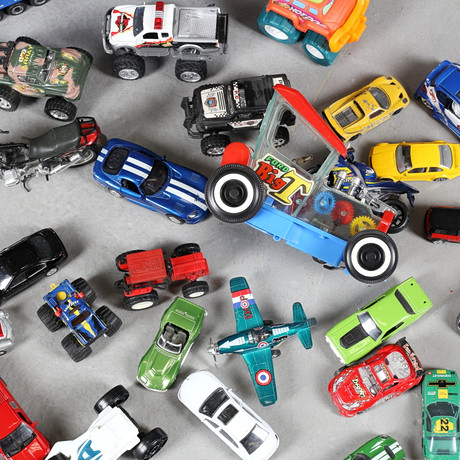
The image size is (460, 460). What are the coordinates of `toy truck` in the screenshot? It's located at (192, 45), (54, 75), (291, 21), (299, 208), (76, 321), (108, 417), (230, 109).